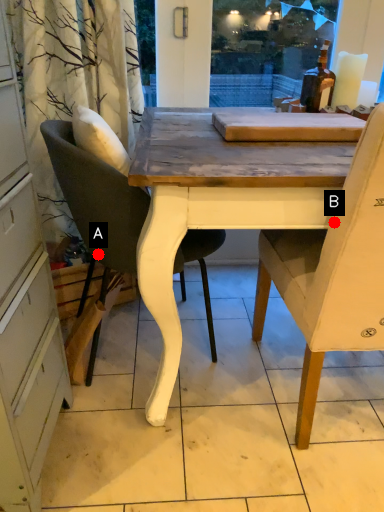
Question: Two points are circled on the image, labeled by A and B beside each circle. Which of the following is the farthest from the observer?

Choices:
 (A) A is further
 (B) B is further

Answer: (A)